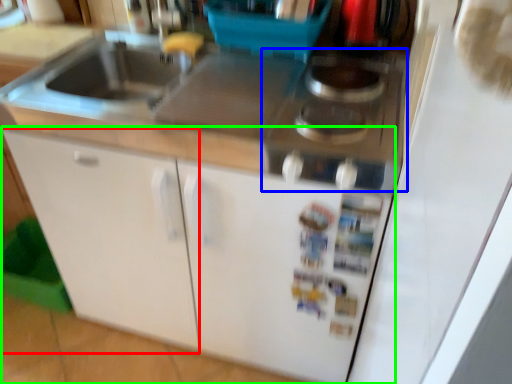
Question: Considering the real-world distances, which object is closest to cabinetry (highlighted by a red box)? gas stove (highlighted by a blue box) or cabinetry (highlighted by a green box).

Choices:
 (A) gas stove
 (B) cabinetry

Answer: (B)